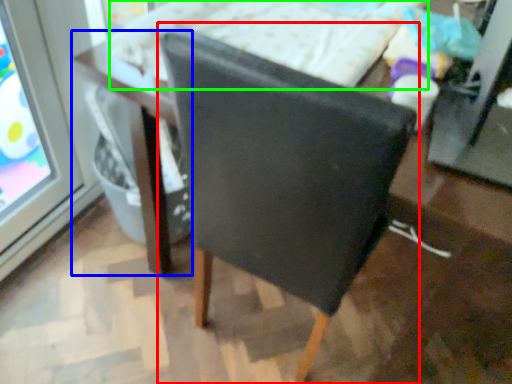
Question: Considering the real-world distances, which object is farthest from chair (highlighted by a red box)? table (highlighted by a blue box) or bed (highlighted by a green box)?

Choices:
 (A) table
 (B) bed

Answer: (B)